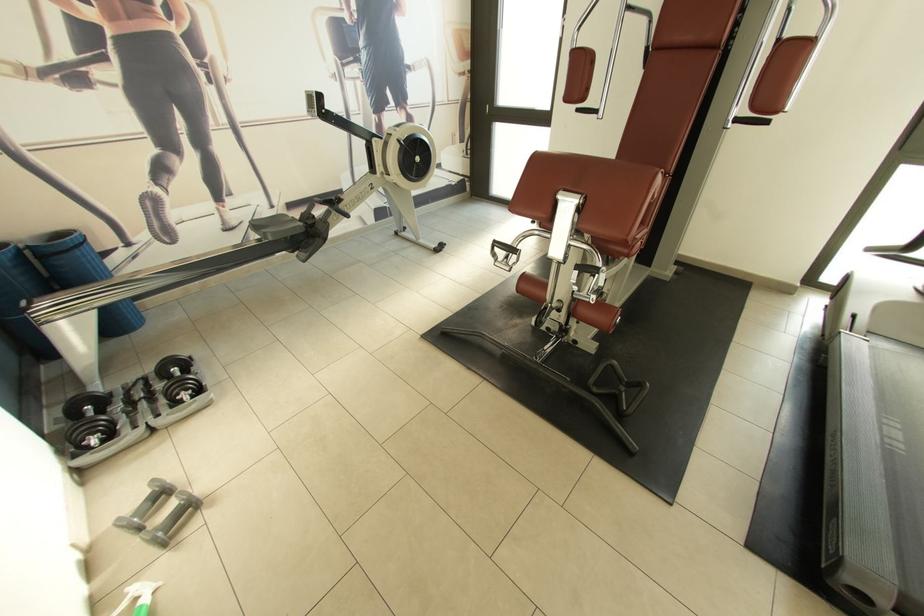
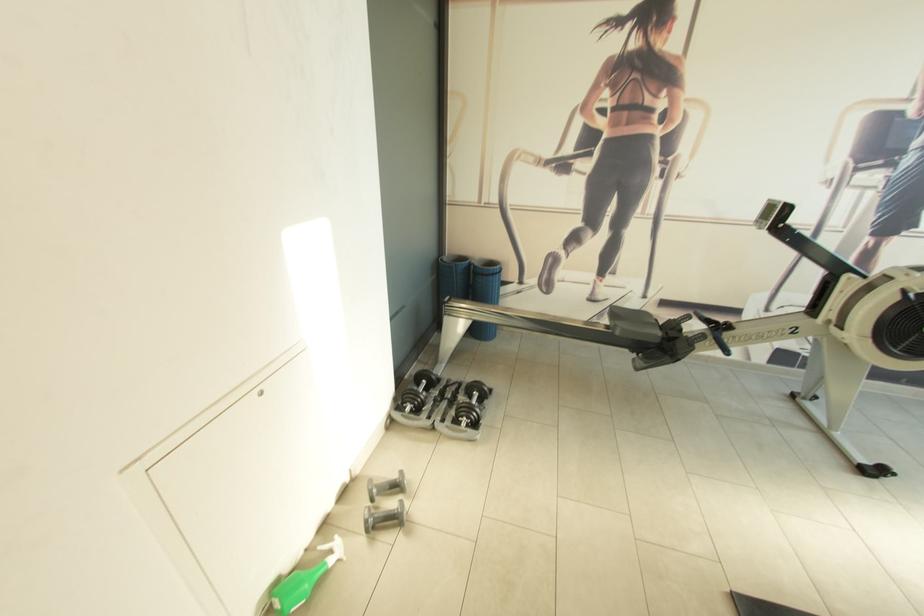
In the second image, find the point that corresponds to (x=275, y=240) in the first image.

(622, 334)